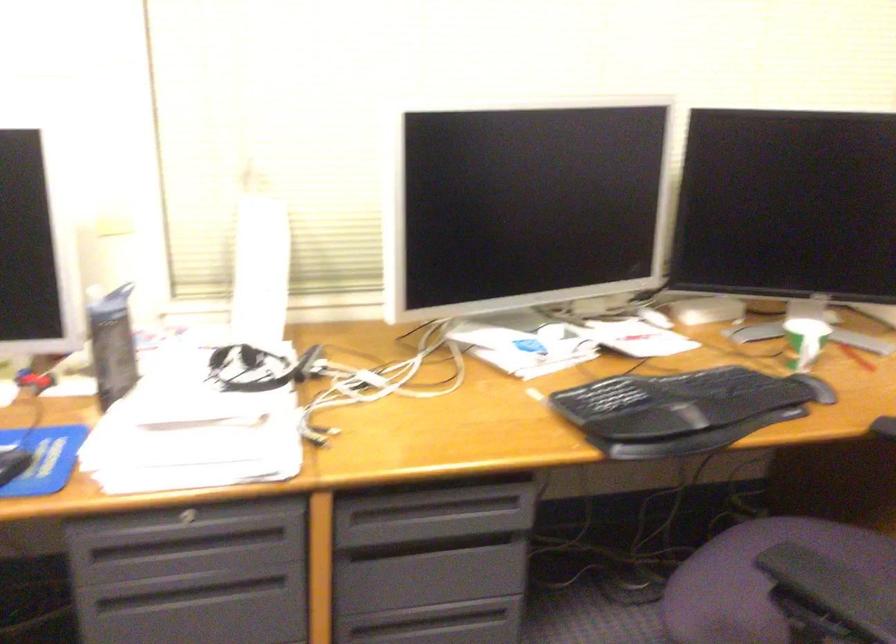
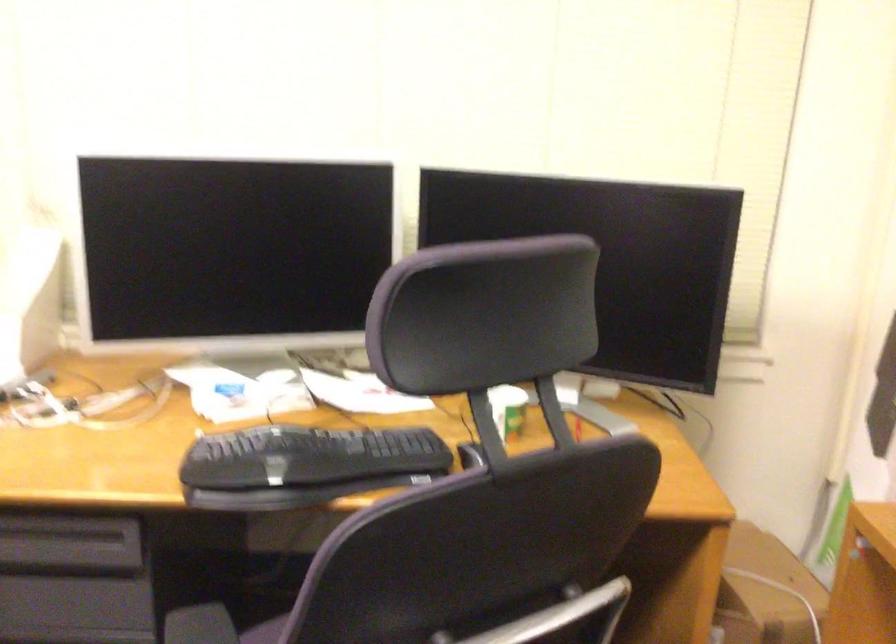
Question: Which direction would the cameraman need to move to produce the second image? Reply with the corresponding letter.

Choices:
 (A) Left
 (B) Right
 (C) Forward
 (D) Backward

Answer: (B)